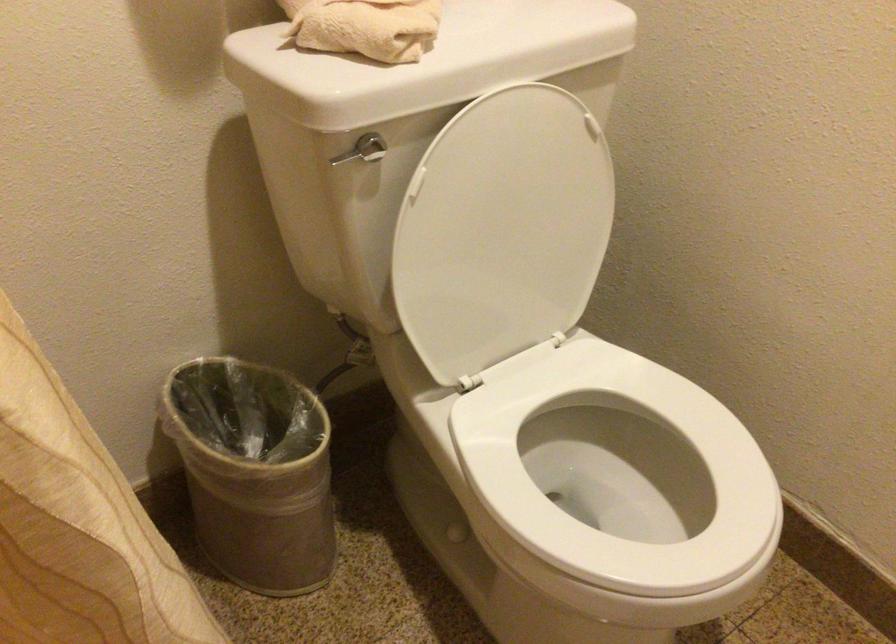
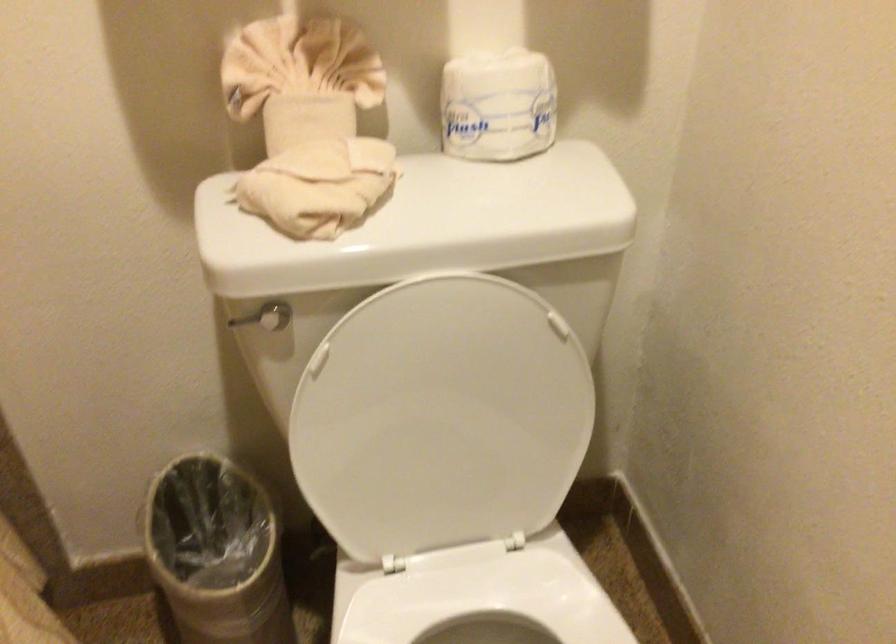
Question: The first image is from the beginning of the video and the second image is from the end. How did the camera likely rotate when shooting the video?

Choices:
 (A) Left
 (B) Right
 (C) Up
 (D) Down

Answer: (A)